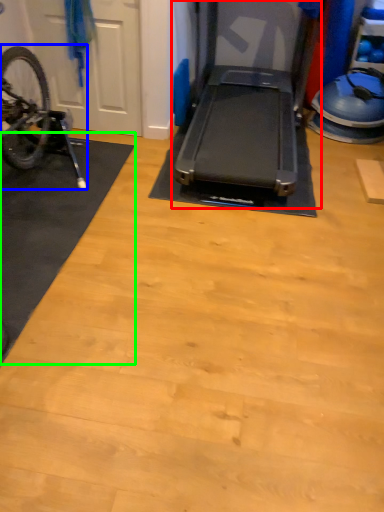
Question: Which object is the farthest from treadmill (highlighted by a red box)? Choose among these: bicycle (highlighted by a blue box) or mat (highlighted by a green box).

Choices:
 (A) bicycle
 (B) mat

Answer: (A)